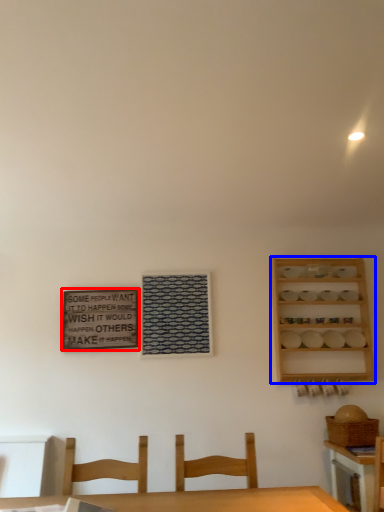
Question: Which of the following is the closest to the observer, bulletin board (highlighted by a red box) or shelf (highlighted by a blue box)?

Choices:
 (A) bulletin board
 (B) shelf

Answer: (B)